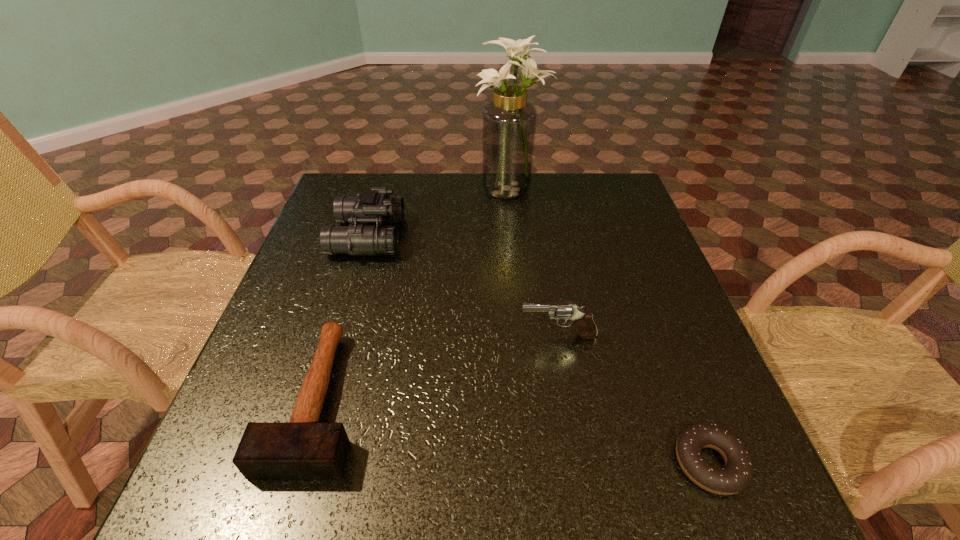
Locate which object is the third closest to the doughnut. Please provide its 2D coordinates. Your answer should be formatted as a tuple, i.e. [(x, y)], where the tuple contains the x and y coordinates of a point satisfying the conditions above.

[(375, 206)]

Locate an element on the screen. object that ranks as the fourth closest to the tallest object is located at coordinates (736, 475).

Locate an element on the screen. vacant region that satisfies the following two spatial constraints: 1. at the barrel of the third tallest object; 2. on the hammer head face of the mallet is located at coordinates (568, 398).

I want to click on vacant space that satisfies the following two spatial constraints: 1. on the front side of the tallest object; 2. through the lenses of the fourth shortest object, so click(x=516, y=236).

This screenshot has height=540, width=960. Identify the location of free location that satisfies the following two spatial constraints: 1. through the lenses of the doughnut; 2. on the left side of the second farthest object. (299, 463).

Identify the location of vacant space that satisfies the following two spatial constraints: 1. on the back side of the doughnut; 2. through the lenses of the second farthest object. This screenshot has width=960, height=540. (622, 236).

Where is `vacant space that satisfies the following two spatial constraints: 1. on the hammer head face of the rightmost object; 2. on the left side of the mallet`? This screenshot has height=540, width=960. vacant space that satisfies the following two spatial constraints: 1. on the hammer head face of the rightmost object; 2. on the left side of the mallet is located at coordinates (300, 463).

At what (x,y) coordinates should I click in order to perform the action: click on free point that satisfies the following two spatial constraints: 1. at the barrel of the third shortest object; 2. on the left side of the rightmost object. Please return your answer as a coordinate pair (x, y). Looking at the image, I should click on (580, 463).